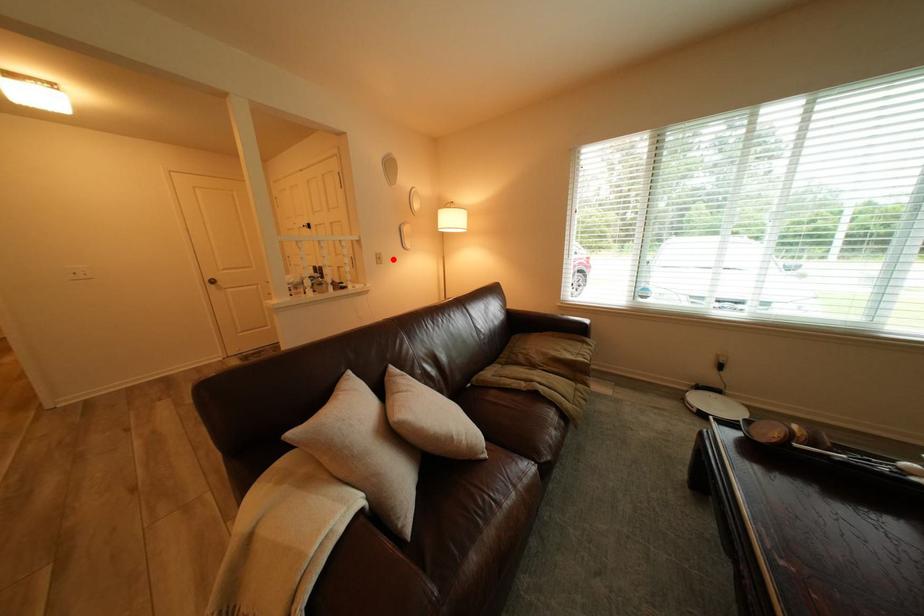
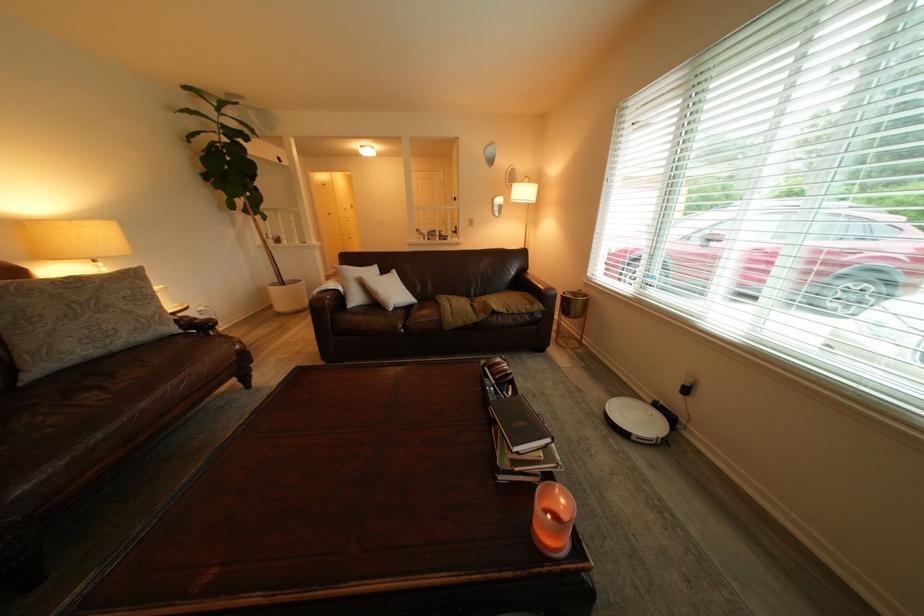
Question: I am providing you with two images of the same scene from different viewpoints. In image1, a red point is highlighted. Considering the same 3D point in image2, which of the following is correct?

Choices:
 (A) It is closer
 (B) It is farther

Answer: (A)